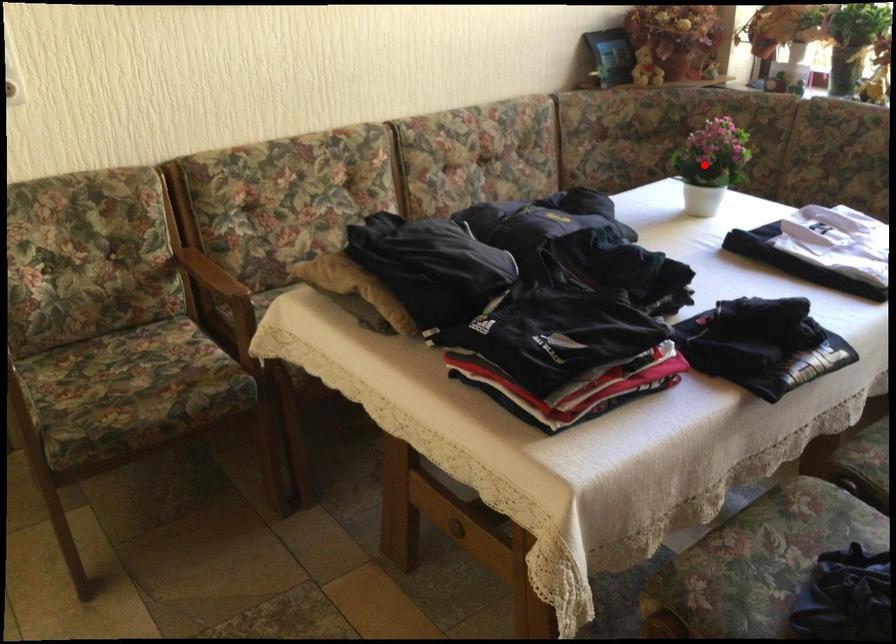
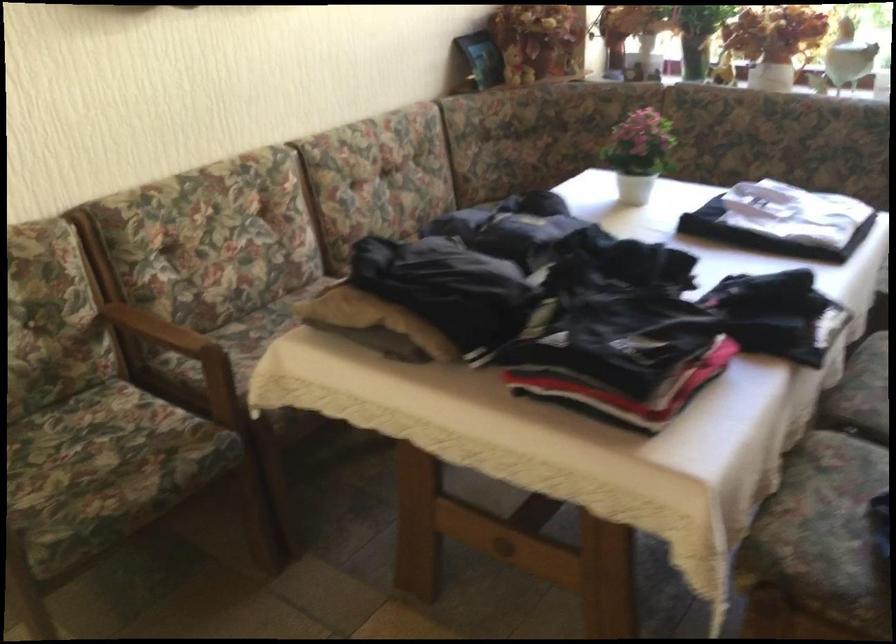
Find the pixel in the second image that matches the highlighted location in the first image.

(639, 153)